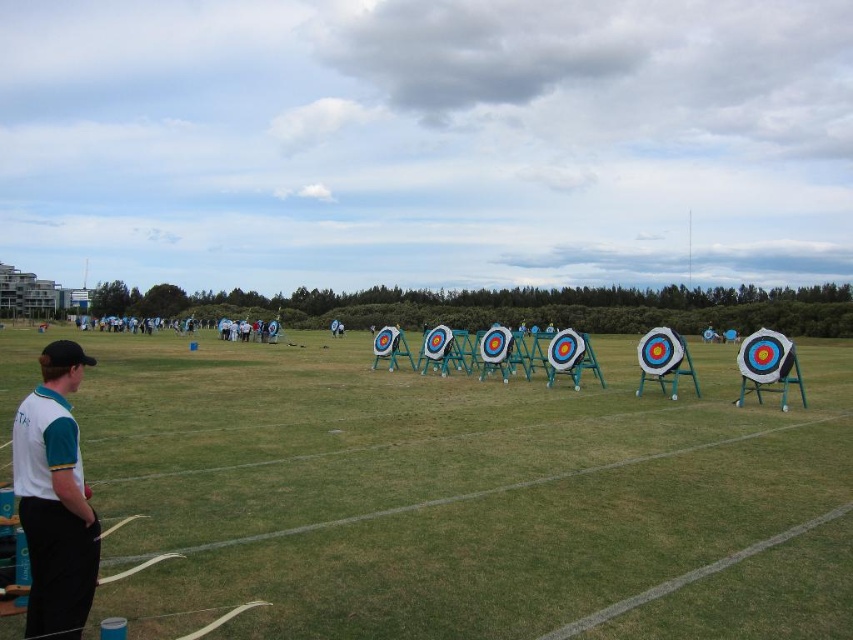
Question: Can you confirm if white paper targets at center is thinner than white fabric shirt at lower left?

Choices:
 (A) yes
 (B) no

Answer: (B)

Question: Is white paper targets at center in front of white fabric shirt at lower left?

Choices:
 (A) no
 (B) yes

Answer: (A)

Question: Which of the following is the closest to the observer?

Choices:
 (A) (33, 634)
 (B) (502, 456)

Answer: (A)

Question: Is white paper targets at center to the right of white fabric shirt at lower left from the viewer's perspective?

Choices:
 (A) no
 (B) yes

Answer: (B)

Question: Which point is farther from the camera taking this photo?

Choices:
 (A) (450, 593)
 (B) (88, 584)

Answer: (A)

Question: Which point is farther to the camera?

Choices:
 (A) white paper targets at center
 (B) white fabric shirt at lower left

Answer: (A)